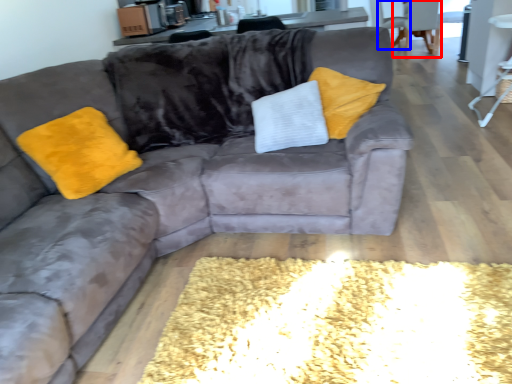
Question: Which of the following is the closest to the observer, armchair (highlighted by a red box) or armchair (highlighted by a blue box)?

Choices:
 (A) armchair
 (B) armchair

Answer: (A)